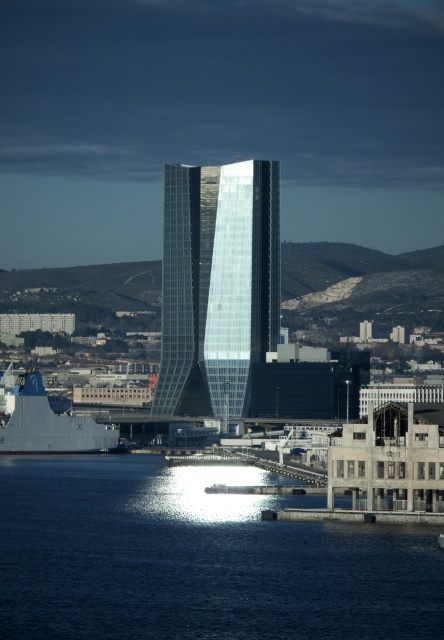
Question: Which point is farther from the camera taking this photo?

Choices:
 (A) (224, 387)
 (B) (83, 419)

Answer: (B)

Question: Which of these objects is positioned closest to the gray metallic ship at lower left?

Choices:
 (A) blue water at lower left
 (B) glassy steel tower at center

Answer: (A)

Question: Observing the image, what is the correct spatial positioning of blue water at lower left in reference to gray metallic ship at lower left?

Choices:
 (A) right
 (B) left

Answer: (A)

Question: Does blue water at lower left have a smaller size compared to gray metallic ship at lower left?

Choices:
 (A) yes
 (B) no

Answer: (B)

Question: Can you confirm if blue water at lower left is positioned above glassy steel tower at center?

Choices:
 (A) no
 (B) yes

Answer: (A)

Question: Which object appears farthest from the camera in this image?

Choices:
 (A) blue water at lower left
 (B) glassy steel tower at center
 (C) gray metallic ship at lower left

Answer: (C)